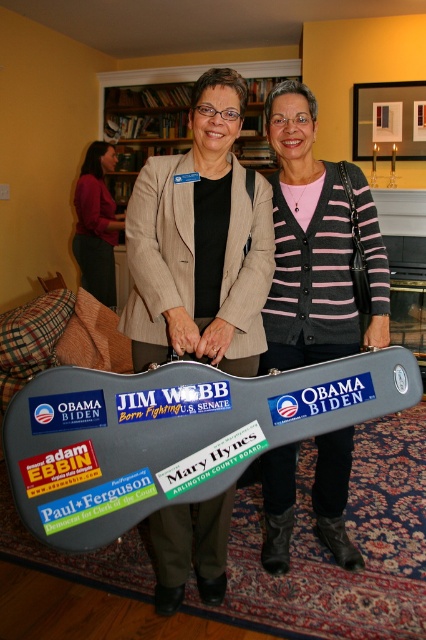
You are organizing a bookshelf and need to place a new book. The wooden bookshelf at upper center is currently full. Can you use the dark red sweater at left to make space?

The wooden bookshelf at upper center has a smaller size compared to dark red sweater at left. Therefore, the sweater is larger and might be able to be used to temporarily hold books while you rearrange the smaller bookshelf.

What is the exact location of the wooden bookshelf at upper center in the image?

The wooden bookshelf at upper center is located at point coordinates of 0.195 in the x and 0.340 in the y direction.